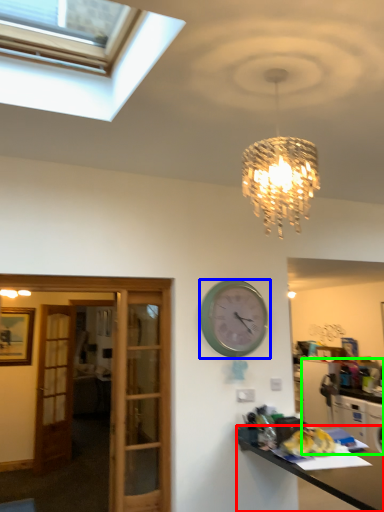
Question: Which object is the closest to the desk (highlighted by a red box)? Choose among these: wall clock (highlighted by a blue box) or cabinetry (highlighted by a green box).

Choices:
 (A) wall clock
 (B) cabinetry

Answer: (A)